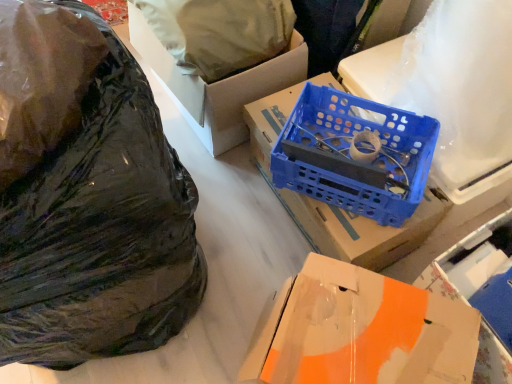
Find the location of a particular element. cardboard box at center, which ranks as the third box in bottom-to-top order is located at coordinates (217, 86).

The height and width of the screenshot is (384, 512). What do you see at coordinates (219, 32) in the screenshot?
I see `matte brown paper at upper center, the second wrapping paper from the right` at bounding box center [219, 32].

This screenshot has height=384, width=512. What do you see at coordinates (321, 141) in the screenshot?
I see `blue plastic wire at center` at bounding box center [321, 141].

Describe the element at coordinates (328, 205) in the screenshot. This screenshot has width=512, height=384. I see `blue plastic crate at center, arranged as the second box when viewed from the top` at that location.

The width and height of the screenshot is (512, 384). Describe the element at coordinates (41, 79) in the screenshot. I see `glossy plastic bag at left, acting as the 2th plastic bag starting from the front` at that location.

This screenshot has width=512, height=384. I want to click on cardboard box at center, which ranks as the third box in bottom-to-top order, so click(217, 86).

Which object is closer to the camera taking this photo, black matte plastic bag at left, the first plastic bag in the front-to-back sequence, or blue plastic crate at center, which appears as the second box when ordered from the bottom?

black matte plastic bag at left, the first plastic bag in the front-to-back sequence, is more forward.

Looking at this image, from a real-world perspective, is black matte plastic bag at left, the first plastic bag in the front-to-back sequence, physically above blue plastic crate at center, arranged as the second box when viewed from the top?

No.

From the image's perspective, which is below, black matte plastic bag at left, which is counted as the 2th plastic bag, starting from the back, or blue plastic crate at center, which appears as the second box when ordered from the bottom?

black matte plastic bag at left, which is counted as the 2th plastic bag, starting from the back.

Considering the positions of objects blue plastic wire at center and black matte plastic bag at left, the first plastic bag in the front-to-back sequence, in the image provided, who is more to the left, blue plastic wire at center or black matte plastic bag at left, the first plastic bag in the front-to-back sequence,?

From the viewer's perspective, black matte plastic bag at left, the first plastic bag in the front-to-back sequence, appears more on the left side.

In the image, there is a blue plastic wire at center. Identify the location of plastic bag below it (from a real-world perspective). This screenshot has height=384, width=512. (87, 196).

Would you say blue plastic wire at center is inside or outside black matte plastic bag at left, which is counted as the 2th plastic bag, starting from the back?

blue plastic wire at center is not enclosed by black matte plastic bag at left, which is counted as the 2th plastic bag, starting from the back.

Considering the relative sizes of blue plastic wire at center and black matte plastic bag at left, the first plastic bag in the front-to-back sequence, in the image provided, is blue plastic wire at center shorter than black matte plastic bag at left, the first plastic bag in the front-to-back sequence,?

Yes.

From a real-world perspective, which plastic bag is the 1st one above the cardboard box at center, the first box in the top-to-bottom sequence? Please provide its 2D coordinates.

[(87, 196)]

Between cardboard box at center, the first box in the top-to-bottom sequence, and black matte plastic bag at left, which is counted as the 2th plastic bag, starting from the back, which one has larger width?

black matte plastic bag at left, which is counted as the 2th plastic bag, starting from the back.

Considering the relative positions of cardboard box at center, which ranks as the third box in bottom-to-top order, and black matte plastic bag at left, which is counted as the 2th plastic bag, starting from the back, in the image provided, is cardboard box at center, which ranks as the third box in bottom-to-top order, to the left of black matte plastic bag at left, which is counted as the 2th plastic bag, starting from the back, from the viewer's perspective?

In fact, cardboard box at center, which ranks as the third box in bottom-to-top order, is to the right of black matte plastic bag at left, which is counted as the 2th plastic bag, starting from the back.

Does cardboard box at center, the first box in the top-to-bottom sequence, have a lesser height compared to black matte plastic bag at left, which is counted as the 2th plastic bag, starting from the back?

Indeed, cardboard box at center, the first box in the top-to-bottom sequence, has a lesser height compared to black matte plastic bag at left, which is counted as the 2th plastic bag, starting from the back.

Is blue plastic wire at center surrounding matte brown paper at upper center, the first wrapping paper in the left-to-right sequence?

That's incorrect, matte brown paper at upper center, the first wrapping paper in the left-to-right sequence, is not inside blue plastic wire at center.

Considering the sizes of objects blue plastic wire at center and matte brown paper at upper center, the first wrapping paper in the left-to-right sequence, in the image provided, who is thinner, blue plastic wire at center or matte brown paper at upper center, the first wrapping paper in the left-to-right sequence,?

Thinner between the two is blue plastic wire at center.

Is blue plastic wire at center shorter than matte brown paper at upper center, the first wrapping paper in the left-to-right sequence?

Incorrect, the height of blue plastic wire at center does not fall short of that of matte brown paper at upper center, the first wrapping paper in the left-to-right sequence.

Does blue plastic wire at center appear on the right side of matte brown paper at upper center, the second wrapping paper from the right?

Yes.

Consider the image. Which of these two, black matte plastic bag at left, which is counted as the 2th plastic bag, starting from the back, or glossy plastic bag at left, acting as the 2th plastic bag starting from the front, is wider?

With larger width is black matte plastic bag at left, which is counted as the 2th plastic bag, starting from the back.

Considering the points (4, 323) and (12, 170), which point is behind, point (4, 323) or point (12, 170)?

Point (4, 323)

Considering the relative sizes of black matte plastic bag at left, which is counted as the 2th plastic bag, starting from the back, and glossy plastic bag at left, acting as the 2th plastic bag starting from the front, in the image provided, is black matte plastic bag at left, which is counted as the 2th plastic bag, starting from the back, shorter than glossy plastic bag at left, acting as the 2th plastic bag starting from the front,?

No.

Is black matte plastic bag at left, which is counted as the 2th plastic bag, starting from the back, smaller than glossy plastic bag at left, the first plastic bag in the back-to-front sequence?

Actually, black matte plastic bag at left, which is counted as the 2th plastic bag, starting from the back, might be larger than glossy plastic bag at left, the first plastic bag in the back-to-front sequence.

Would you say cardboard box at center, which ranks as the third box in bottom-to-top order, is inside or outside white matte wrapping paper at upper right, acting as the 1th wrapping paper starting from the right?

cardboard box at center, which ranks as the third box in bottom-to-top order, is not inside white matte wrapping paper at upper right, acting as the 1th wrapping paper starting from the right, it's outside.

Can you confirm if cardboard box at center, which ranks as the third box in bottom-to-top order, is wider than white matte wrapping paper at upper right, acting as the 1th wrapping paper starting from the right?

Correct, the width of cardboard box at center, which ranks as the third box in bottom-to-top order, exceeds that of white matte wrapping paper at upper right, acting as the 1th wrapping paper starting from the right.

Based on the photo, considering the sizes of objects cardboard box at center, which ranks as the third box in bottom-to-top order, and white matte wrapping paper at upper right, arranged as the second wrapping paper when viewed from the left, in the image provided, who is taller, cardboard box at center, which ranks as the third box in bottom-to-top order, or white matte wrapping paper at upper right, arranged as the second wrapping paper when viewed from the left,?

With more height is white matte wrapping paper at upper right, arranged as the second wrapping paper when viewed from the left.

Is cardboard box at center, the first box in the top-to-bottom sequence, oriented towards white matte wrapping paper at upper right, acting as the 1th wrapping paper starting from the right?

Result: No.

In the image, is cardboard box at center, which ranks as the third box in bottom-to-top order, on the left side or the right side of orange cardboard box at center, acting as the first box starting from the bottom?

cardboard box at center, which ranks as the third box in bottom-to-top order, is to the left of orange cardboard box at center, acting as the first box starting from the bottom.

Would you consider cardboard box at center, the first box in the top-to-bottom sequence, to be distant from orange cardboard box at center, acting as the first box starting from the bottom?

That's not correct — cardboard box at center, the first box in the top-to-bottom sequence, is a little close to orange cardboard box at center, acting as the first box starting from the bottom.

Could you tell me if cardboard box at center, the first box in the top-to-bottom sequence, is facing orange cardboard box at center, acting as the 3th box starting from the top?

No, cardboard box at center, the first box in the top-to-bottom sequence, is not facing towards orange cardboard box at center, acting as the 3th box starting from the top.

Which object is more forward, cardboard box at center, which ranks as the third box in bottom-to-top order, or orange cardboard box at center, acting as the first box starting from the bottom?

orange cardboard box at center, acting as the first box starting from the bottom, is closer to the camera.

Where is `box that is the 2nd object located behind the black matte plastic bag at left, which is counted as the 2th plastic bag, starting from the back`? The height and width of the screenshot is (384, 512). box that is the 2nd object located behind the black matte plastic bag at left, which is counted as the 2th plastic bag, starting from the back is located at coordinates (328, 205).

You are a GUI agent. You are given a task and a screenshot of the screen. Output one action in this format:
    pyautogui.click(x=<x>, y=<y>)
    Task: Click on the 2nd plastic bag in front of the blue plastic wire at center, starting your count from the anchor
    
    Given the screenshot: What is the action you would take?
    pyautogui.click(x=87, y=196)

From the image, which object appears to be farther from glossy plastic bag at left, acting as the 2th plastic bag starting from the front, orange cardboard box at center, acting as the first box starting from the bottom, or matte brown paper at upper center, the first wrapping paper in the left-to-right sequence?

Based on the image, orange cardboard box at center, acting as the first box starting from the bottom, appears to be further to glossy plastic bag at left, acting as the 2th plastic bag starting from the front.

Which object lies nearer to the anchor point blue plastic wire at center, white matte wrapping paper at upper right, acting as the 1th wrapping paper starting from the right, or orange cardboard box at center, acting as the 3th box starting from the top?

white matte wrapping paper at upper right, acting as the 1th wrapping paper starting from the right, lies closer to blue plastic wire at center than the other object.

Estimate the real-world distances between objects in this image. Which object is further from black matte plastic bag at left, the first plastic bag in the front-to-back sequence, cardboard box at center, which ranks as the third box in bottom-to-top order, or blue plastic wire at center?

Based on the image, cardboard box at center, which ranks as the third box in bottom-to-top order, appears to be further to black matte plastic bag at left, the first plastic bag in the front-to-back sequence.

Looking at the image, which one is located closer to white matte wrapping paper at upper right, acting as the 1th wrapping paper starting from the right, matte brown paper at upper center, the first wrapping paper in the left-to-right sequence, or cardboard box at center, which ranks as the third box in bottom-to-top order?

cardboard box at center, which ranks as the third box in bottom-to-top order, is closer to white matte wrapping paper at upper right, acting as the 1th wrapping paper starting from the right.

Considering their positions, is orange cardboard box at center, acting as the first box starting from the bottom, positioned closer to cardboard box at center, which ranks as the third box in bottom-to-top order, than matte brown paper at upper center, the first wrapping paper in the left-to-right sequence?

Based on the image, matte brown paper at upper center, the first wrapping paper in the left-to-right sequence, appears to be nearer to cardboard box at center, which ranks as the third box in bottom-to-top order.

From the image, which object appears to be nearer to glossy plastic bag at left, the first plastic bag in the back-to-front sequence, black matte plastic bag at left, the first plastic bag in the front-to-back sequence, or cardboard box at center, the first box in the top-to-bottom sequence?

Based on the image, black matte plastic bag at left, the first plastic bag in the front-to-back sequence, appears to be nearer to glossy plastic bag at left, the first plastic bag in the back-to-front sequence.

When comparing their distances from black matte plastic bag at left, which is counted as the 2th plastic bag, starting from the back, does white matte wrapping paper at upper right, arranged as the second wrapping paper when viewed from the left, or glossy plastic bag at left, acting as the 2th plastic bag starting from the front, seem further?

white matte wrapping paper at upper right, arranged as the second wrapping paper when viewed from the left, is further to black matte plastic bag at left, which is counted as the 2th plastic bag, starting from the back.

From the image, which object appears to be farther from orange cardboard box at center, acting as the 3th box starting from the top, blue plastic wire at center or blue plastic crate at center, which appears as the second box when ordered from the bottom?

blue plastic wire at center.

Locate an element on the screen. Image resolution: width=512 pixels, height=384 pixels. plastic bag situated between black matte plastic bag at left, which is counted as the 2th plastic bag, starting from the back, and blue plastic crate at center, arranged as the second box when viewed from the top, from left to right is located at coordinates point(41,79).

You are a GUI agent. You are given a task and a screenshot of the screen. Output one action in this format:
    pyautogui.click(x=<x>, y=<y>)
    Task: Click on the wrapping paper situated between black matte plastic bag at left, which is counted as the 2th plastic bag, starting from the back, and blue plastic wire at center from left to right
    
    Given the screenshot: What is the action you would take?
    pyautogui.click(x=219, y=32)

Where is `wrapping paper between cardboard box at center, which ranks as the third box in bottom-to-top order, and orange cardboard box at center, acting as the 3th box starting from the top, from top to bottom`? The height and width of the screenshot is (384, 512). wrapping paper between cardboard box at center, which ranks as the third box in bottom-to-top order, and orange cardboard box at center, acting as the 3th box starting from the top, from top to bottom is located at coordinates (461, 86).

Find the location of `box between cardboard box at center, which ranks as the third box in bottom-to-top order, and orange cardboard box at center, acting as the first box starting from the bottom, from top to bottom`. box between cardboard box at center, which ranks as the third box in bottom-to-top order, and orange cardboard box at center, acting as the first box starting from the bottom, from top to bottom is located at coordinates (328, 205).